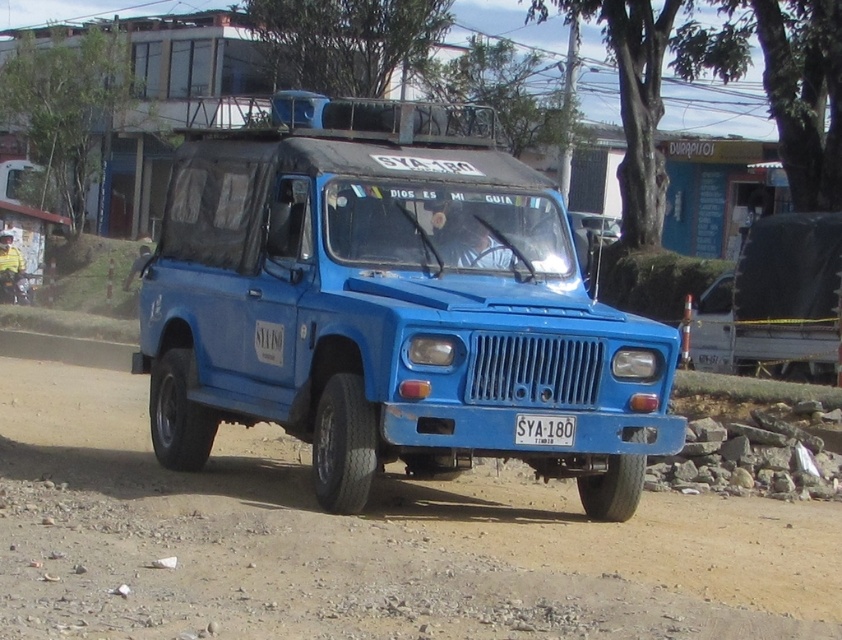
You are standing at the origin point of the coordinate system. Where is the dirt field at center located?

The dirt field at center is located at point (364,541).

You are a delivery driver who needs to park your vehicle on the dirt field at center. Your vehicle is 2 meters wide. Can you safely park there without overlapping the white plastic license plate at center?

The dirt field at center might be wider than white plastic license plate at center, so there is a possibility that the dirt field is wide enough for the vehicle. However, since the exact width isn not specified, it is recommended to check the actual space before parking.

You are a delivery person needing to cross a dirt field at center to reach a delivery point. There is a blue matte jeep at center in your path. Can you pass under the jeep without hitting your head?

The blue matte jeep at center is much taller than the dirt field at center, so yes, you can pass under the blue matte jeep at center without hitting your head since there is sufficient clearance.